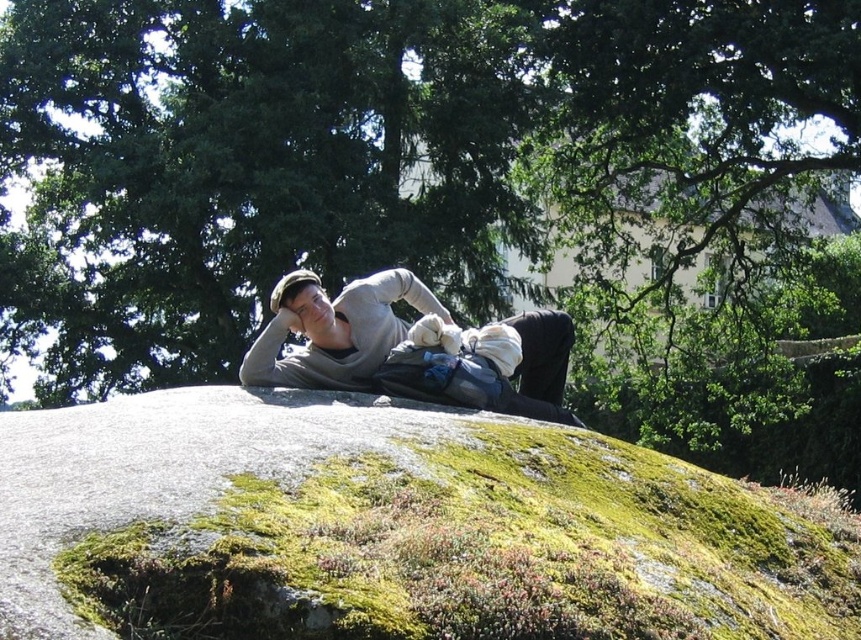
Question: Which point is closer to the camera?

Choices:
 (A) gray cotton sweater at center
 (B) green mossy rock at center

Answer: (B)

Question: Can you confirm if green leafy tree at upper center is smaller than green mossy rock at center?

Choices:
 (A) yes
 (B) no

Answer: (B)

Question: Which object appears closest to the camera in this image?

Choices:
 (A) green mossy rock at center
 (B) gray cotton sweater at center
 (C) green leafy tree at upper center

Answer: (A)

Question: Does green leafy tree at upper center have a greater width compared to gray cotton sweater at center?

Choices:
 (A) yes
 (B) no

Answer: (A)

Question: Considering the relative positions of green mossy rock at center and gray cotton sweater at center in the image provided, where is green mossy rock at center located with respect to gray cotton sweater at center?

Choices:
 (A) right
 (B) left

Answer: (A)

Question: Which of the following is the closest to the observer?

Choices:
 (A) green leafy tree at upper center
 (B) green mossy rock at center
 (C) gray cotton sweater at center

Answer: (B)